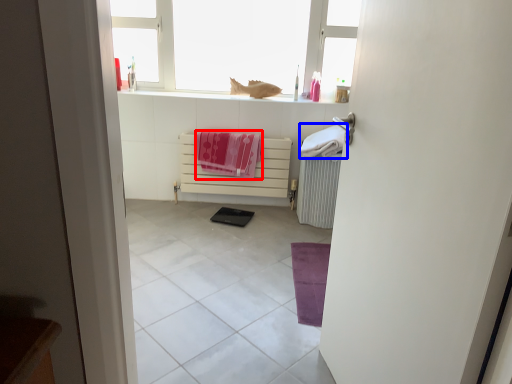
Question: Which point is closer to the camera, beach towel (highlighted by a red box) or beach towel (highlighted by a blue box)?

Choices:
 (A) beach towel
 (B) beach towel

Answer: (B)